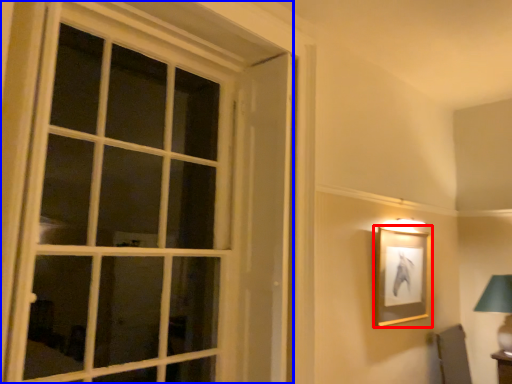
Question: Which of the following is the farthest to the observer, picture frame (highlighted by a red box) or window (highlighted by a blue box)?

Choices:
 (A) picture frame
 (B) window

Answer: (A)